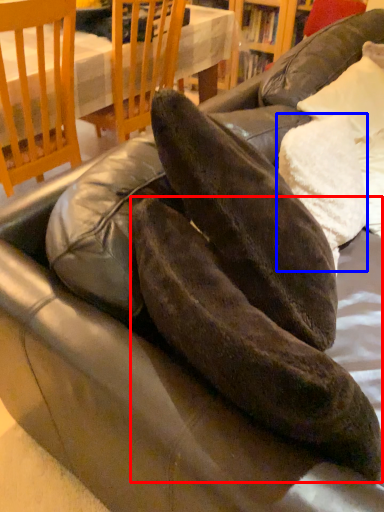
Question: Which of the following is the farthest to the observer, leather shoe (highlighted by a red box) or pillow (highlighted by a blue box)?

Choices:
 (A) leather shoe
 (B) pillow

Answer: (B)